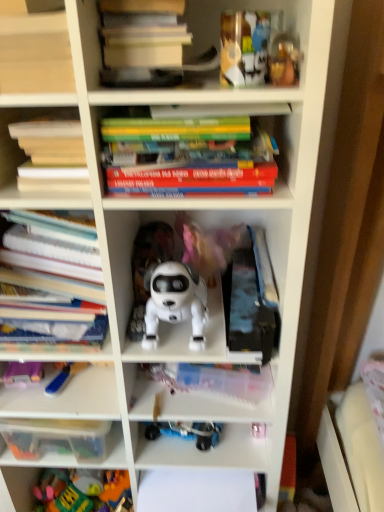
Question: Is hardcover book at upper left, the 2th book positioned from the bottom, inside the boundaries of plastic colorful toys at lower left, which ranks as the 1th toy in bottom-to-top order, or outside?

Choices:
 (A) inside
 (B) outside

Answer: (B)

Question: From the image's perspective, relative to plastic colorful toys at lower left, the 1th toy positioned from the back, is hardcover book at upper left, the 2th book positioned from the bottom, above or below?

Choices:
 (A) above
 (B) below

Answer: (A)

Question: Which object is positioned closest to the metallic gold toy at upper right, the fourth toy positioned from the back?

Choices:
 (A) matte plastic books at upper left
 (B) plastic colorful toys at lower left, positioned as the fourth toy in front-to-back order
 (C) white matte robot dog at center, which is the third toy from left to right
 (D) blue plastic toy at lower left, which ranks as the fourth toy in right-to-left order
 (E) clear plastic container at lower left

Answer: (A)

Question: Based on their relative distances, which object is farther from the blue plastic toy at lower left, the third toy positioned from the front?

Choices:
 (A) white matte robot dog at center, the 3th toy when ordered from back to front
 (B) white paper at left, arranged as the fourth book when viewed from the top
 (C) metallic gold toy at upper right, which is counted as the 1th toy, starting from the top
 (D) plastic colorful toys at lower left, which is counted as the second toy, starting from the left
 (E) clear plastic container at lower left

Answer: (C)